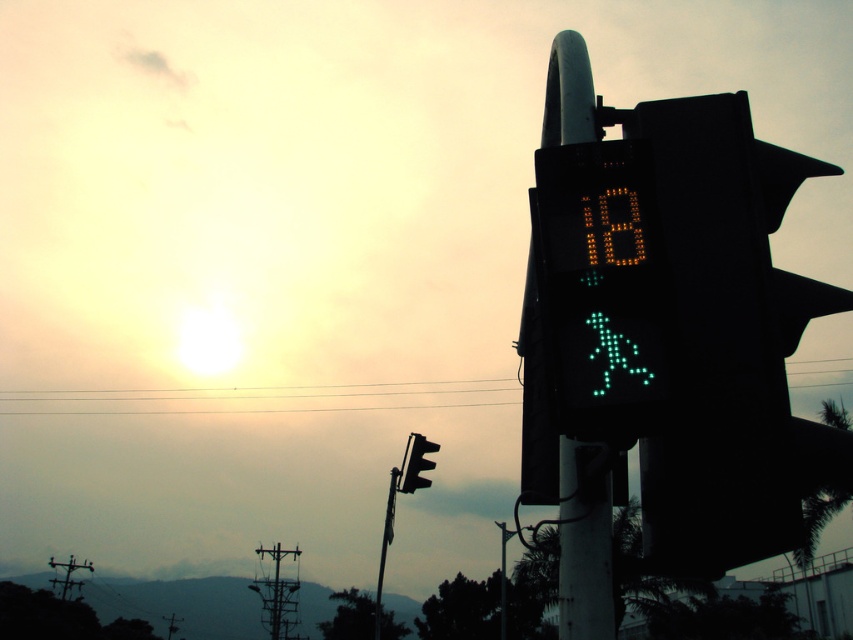
Question: Which of the following is the farthest from the observer?

Choices:
 (A) black matte pole at center
 (B) black plastic traffic light at center
 (C) black plastic pedestrian signal at right

Answer: (B)

Question: Which object appears closest to the camera in this image?

Choices:
 (A) black matte pole at center
 (B) black plastic pedestrian signal at right
 (C) green wire at upper center

Answer: (B)

Question: Considering the relative positions of black plastic pedestrian signal at right and black plastic traffic light at center in the image provided, where is black plastic pedestrian signal at right located with respect to black plastic traffic light at center?

Choices:
 (A) right
 (B) left

Answer: (A)

Question: Is black matte pole at center to the left of black plastic traffic light at center from the viewer's perspective?

Choices:
 (A) no
 (B) yes

Answer: (A)

Question: Considering the relative positions of black matte pole at center and green wire at upper center in the image provided, where is black matte pole at center located with respect to green wire at upper center?

Choices:
 (A) above
 (B) below

Answer: (A)

Question: Estimate the real-world distances between objects in this image. Which object is farther from the black matte pole at center?

Choices:
 (A) black plastic traffic light at center
 (B) green wire at upper center
 (C) black plastic pedestrian signal at right

Answer: (B)